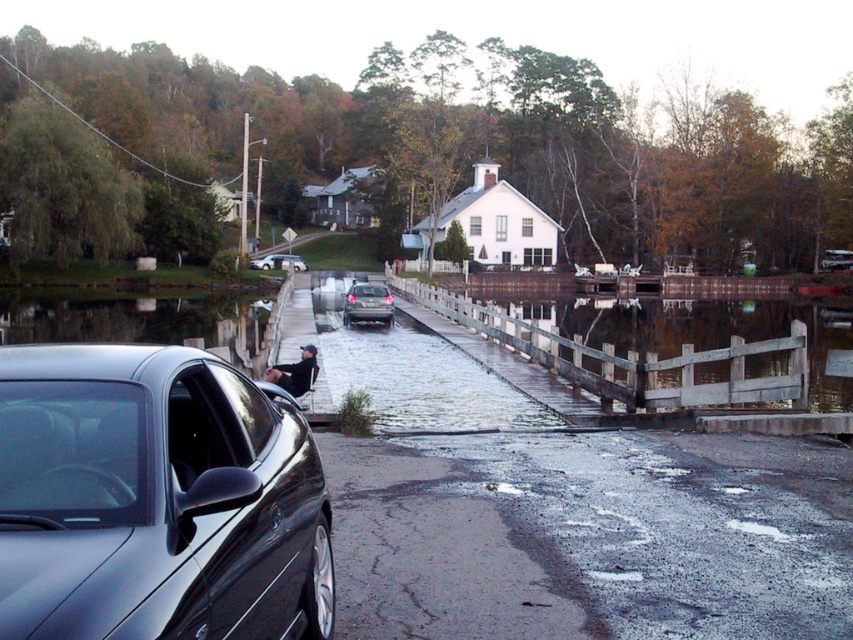
Question: Which of the following is the farthest from the observer?

Choices:
 (A) (158, 605)
 (B) (503, 419)
 (C) (374, 314)
 (D) (802, 392)

Answer: (C)

Question: Which point appears closest to the camera in this image?

Choices:
 (A) (263, 268)
 (B) (363, 284)
 (C) (49, 580)

Answer: (C)

Question: Which object is positioned closest to the wooden fence at center?

Choices:
 (A) metallic silver car at center
 (B) slick asphalt flood at center
 (C) satin silver sedan at center

Answer: (B)

Question: Does wooden fence at center have a lesser width compared to metallic silver car at center?

Choices:
 (A) no
 (B) yes

Answer: (A)

Question: Can you confirm if satin silver sedan at center is bigger than metallic silver car at center?

Choices:
 (A) no
 (B) yes

Answer: (B)

Question: Does wooden fence at center have a smaller size compared to satin black sedan at center?

Choices:
 (A) yes
 (B) no

Answer: (B)